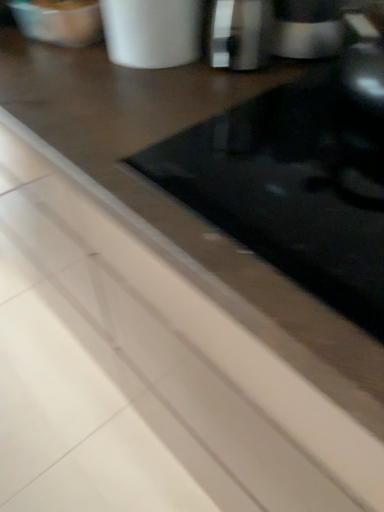
Question: Is metallic silver cup at upper center at the right side of sleek silver coffee machine at upper right?

Choices:
 (A) yes
 (B) no

Answer: (B)

Question: Is sleek silver coffee machine at upper right completely or partially inside metallic silver cup at upper center?

Choices:
 (A) yes
 (B) no

Answer: (B)

Question: Does metallic silver cup at upper center come behind sleek silver coffee machine at upper right?

Choices:
 (A) yes
 (B) no

Answer: (B)

Question: Does metallic silver cup at upper center have a lesser width compared to sleek silver coffee machine at upper right?

Choices:
 (A) no
 (B) yes

Answer: (A)

Question: Considering the relative sizes of metallic silver cup at upper center and sleek silver coffee machine at upper right in the image provided, is metallic silver cup at upper center shorter than sleek silver coffee machine at upper right?

Choices:
 (A) yes
 (B) no

Answer: (B)

Question: Is metallic silver cup at upper center looking in the opposite direction of sleek silver coffee machine at upper right?

Choices:
 (A) no
 (B) yes

Answer: (A)

Question: Would you consider sleek silver coffee machine at upper right to be distant from metallic silver cup at upper center?

Choices:
 (A) yes
 (B) no

Answer: (B)

Question: Does sleek silver coffee machine at upper right have a lesser width compared to metallic silver cup at upper center?

Choices:
 (A) no
 (B) yes

Answer: (B)

Question: Is sleek silver coffee machine at upper right outside metallic silver cup at upper center?

Choices:
 (A) no
 (B) yes

Answer: (B)

Question: Is sleek silver coffee machine at upper right positioned in front of metallic silver cup at upper center?

Choices:
 (A) yes
 (B) no

Answer: (B)

Question: Considering the relative sizes of sleek silver coffee machine at upper right and metallic silver cup at upper center in the image provided, is sleek silver coffee machine at upper right wider than metallic silver cup at upper center?

Choices:
 (A) yes
 (B) no

Answer: (B)

Question: From a real-world perspective, is sleek silver coffee machine at upper right physically below metallic silver cup at upper center?

Choices:
 (A) no
 (B) yes

Answer: (B)

Question: Would you say metallic silver cup at upper center is to the left or to the right of sleek silver coffee machine at upper right in the picture?

Choices:
 (A) left
 (B) right

Answer: (A)